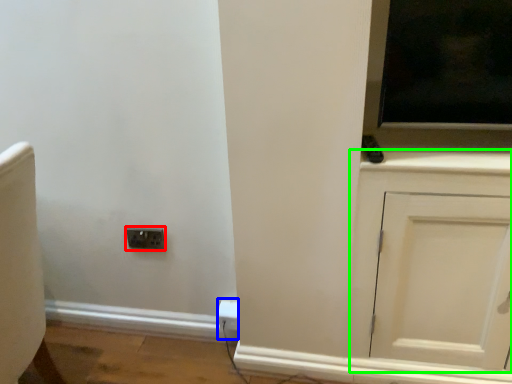
Question: Estimate the real-world distances between objects in this image. Which object is farther from socket (highlighted by a red box), electric outlet (highlighted by a blue box) or cabinetry (highlighted by a green box)?

Choices:
 (A) electric outlet
 (B) cabinetry

Answer: (B)